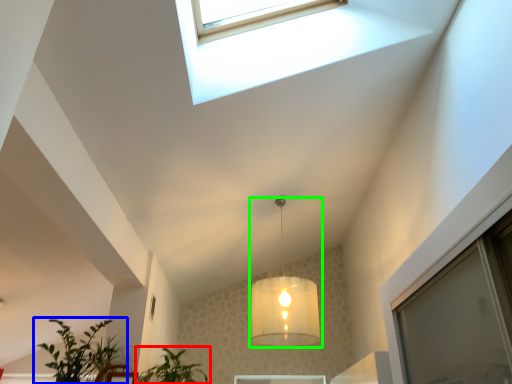
Question: Based on their relative distances, which object is farther from houseplant (highlighted by a red box)? Choose from houseplant (highlighted by a blue box) and lamp (highlighted by a green box).

Choices:
 (A) houseplant
 (B) lamp

Answer: (B)